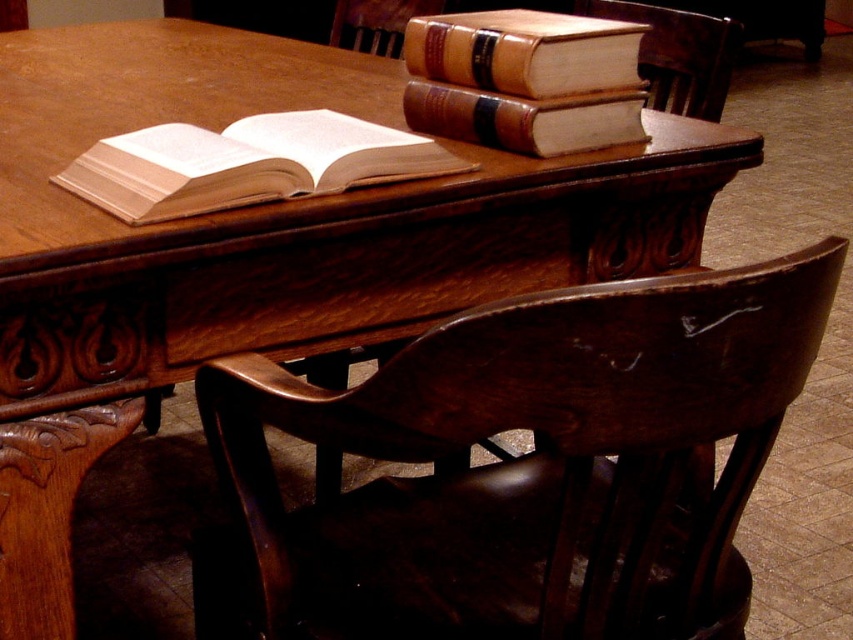
Can you confirm if brown leather book at upper center is bigger than dark brown wood chair at upper right?

No, brown leather book at upper center is not bigger than dark brown wood chair at upper right.

Can you confirm if brown leather book at upper center is positioned below dark brown wood chair at upper right?

Indeed, brown leather book at upper center is positioned under dark brown wood chair at upper right.

Who is more forward, (637, 108) or (679, 96)?

Point (637, 108) is in front.

Where is `brown leather book at upper center`? brown leather book at upper center is located at coordinates (x=525, y=118).

Who is positioned more to the left, dark wood chair at center or wooden chair at center?

Positioned to the left is wooden chair at center.

Does dark wood chair at center have a greater width compared to wooden chair at center?

Indeed, dark wood chair at center has a greater width compared to wooden chair at center.

Does point (662, 525) lie behind point (393, 1)?

No, (662, 525) is in front of (393, 1).

Identify the location of dark wood chair at center. (521, 467).

Is light beige paper book at center smaller than brown leather book at upper right?

Actually, light beige paper book at center might be larger than brown leather book at upper right.

Is point (318, 131) positioned behind point (631, 86)?

No.

Does point (102, 188) come behind point (508, 65)?

No, (102, 188) is in front of (508, 65).

This screenshot has height=640, width=853. I want to click on light beige paper book at center, so click(x=247, y=163).